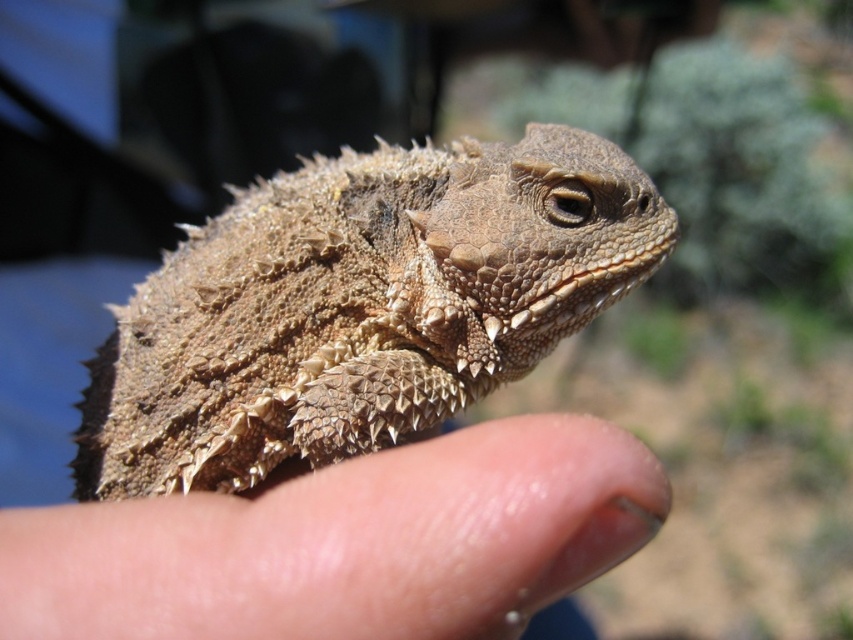
Question: Which point is farther to the camera?

Choices:
 (A) (386, 467)
 (B) (546, 184)

Answer: (B)

Question: Does brown scaly lizard at center have a greater width compared to dry skin at center?

Choices:
 (A) no
 (B) yes

Answer: (B)

Question: Which of the following is the farthest from the observer?

Choices:
 (A) dry skin at center
 (B) brown scaly lizard at center

Answer: (B)

Question: Does brown scaly lizard at center have a smaller size compared to dry skin at center?

Choices:
 (A) yes
 (B) no

Answer: (B)

Question: Does brown scaly lizard at center appear on the right side of dry skin at center?

Choices:
 (A) no
 (B) yes

Answer: (A)